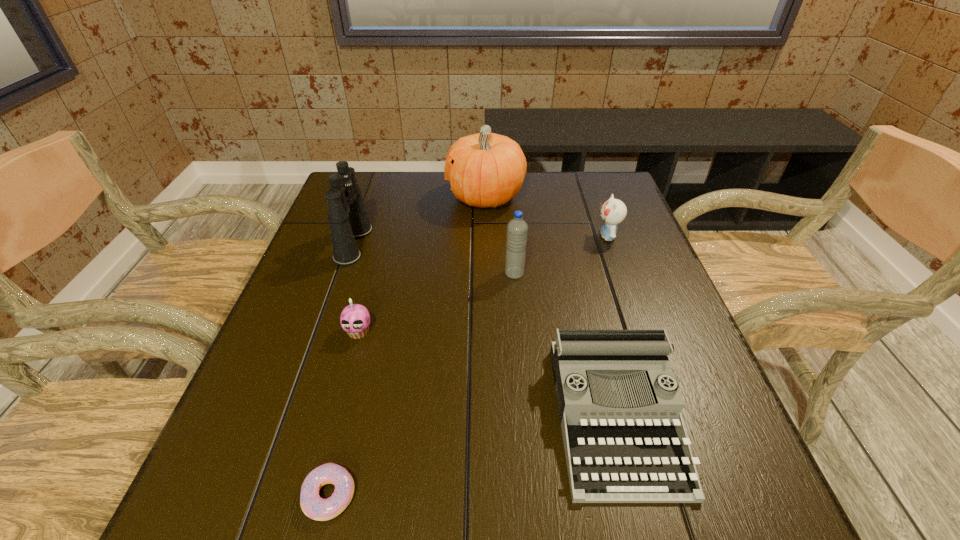
The image size is (960, 540). What are the coordinates of `free space at the left edge` in the screenshot? It's located at (249, 377).

At what (x,y) coordinates should I click in order to perform the action: click on free space at the right edge. Please return your answer as a coordinate pair (x, y). This screenshot has height=540, width=960. Looking at the image, I should click on (621, 302).

At what (x,y) coordinates should I click in order to perform the action: click on free location at the far left corner of the desktop. Please return your answer as a coordinate pair (x, y). The height and width of the screenshot is (540, 960). Looking at the image, I should click on (385, 186).

I want to click on free point between the kitten and the doughnut, so click(468, 366).

The width and height of the screenshot is (960, 540). What are the coordinates of `free area in between the fourth tallest object and the fifth shortest object` in the screenshot? It's located at 561,255.

The height and width of the screenshot is (540, 960). I want to click on vacant space in between the water bottle and the binoculars, so click(434, 259).

Locate an element on the screen. vacant area that lies between the binoculars and the farthest object is located at coordinates (420, 221).

You are a GUI agent. You are given a task and a screenshot of the screen. Output one action in this format:
    pyautogui.click(x=<x>, y=<y>)
    Task: Click on the free space between the farthest object and the fifth shortest object
    
    Given the screenshot: What is the action you would take?
    pyautogui.click(x=500, y=235)

Where is `vacant point located between the fifth farthest object and the kitten`? The height and width of the screenshot is (540, 960). vacant point located between the fifth farthest object and the kitten is located at coordinates (483, 284).

The image size is (960, 540). I want to click on vacant space that is in between the leftmost object and the cupcake, so click(x=356, y=288).